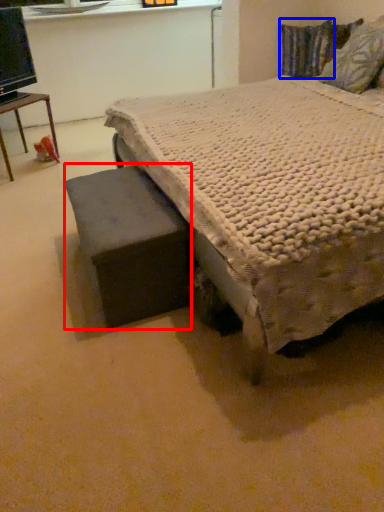
Question: Which object appears closest to the camera in this image, swivel chair (highlighted by a red box) or pillow (highlighted by a blue box)?

Choices:
 (A) swivel chair
 (B) pillow

Answer: (A)